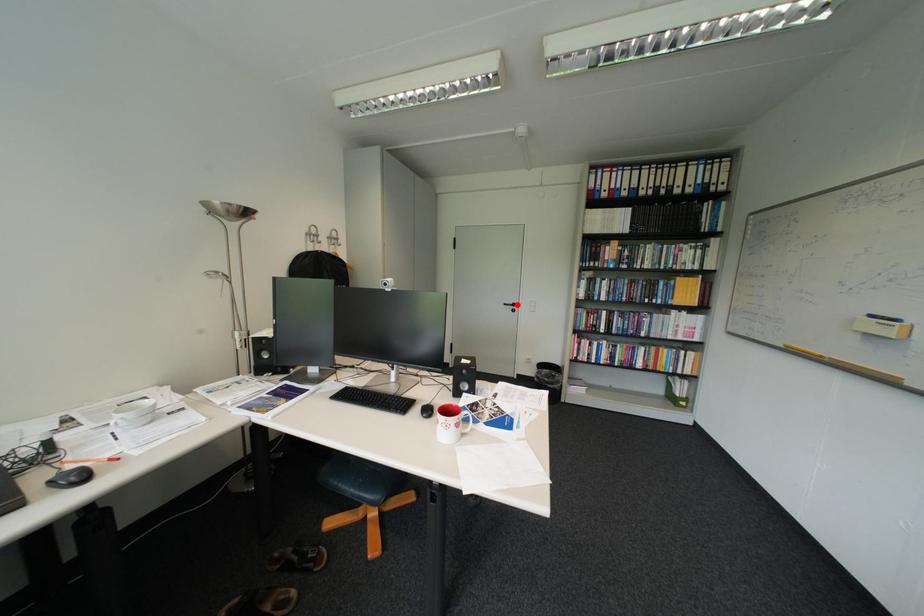
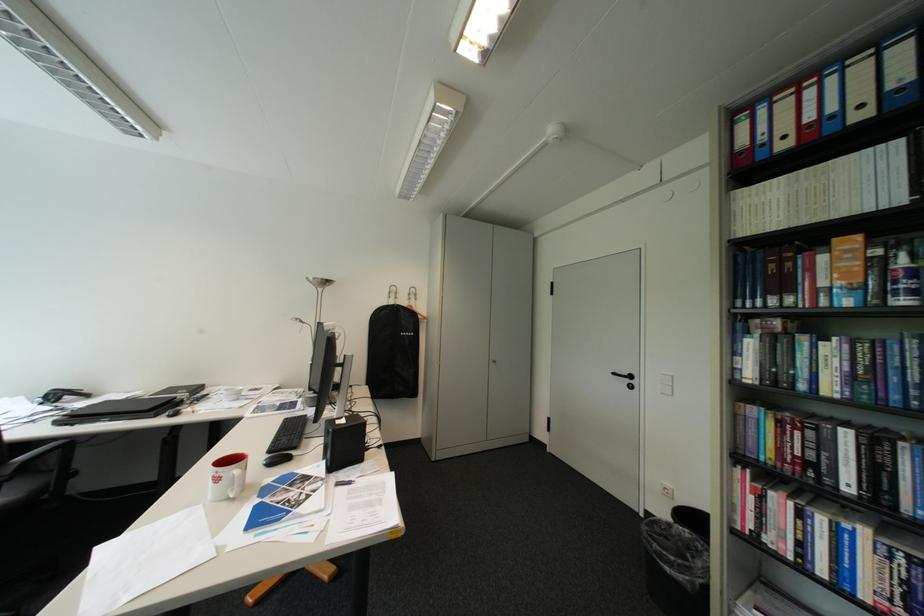
Question: I am providing you with two images of the same scene from different viewpoints. A red point is marked on the first image. Can you still see the location of the red point in image 2?

Choices:
 (A) Yes
 (B) No

Answer: (A)